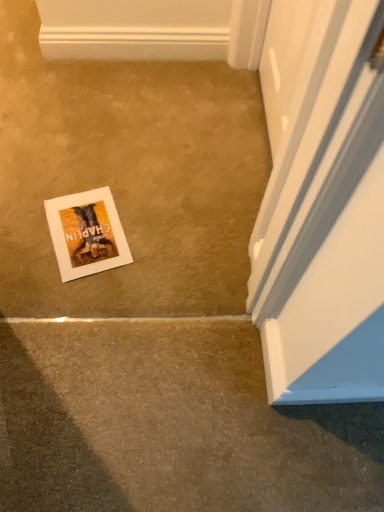
Locate an element on the screen. free space above matte paper picture frame at center (from a real-world perspective) is located at coordinates (78, 226).